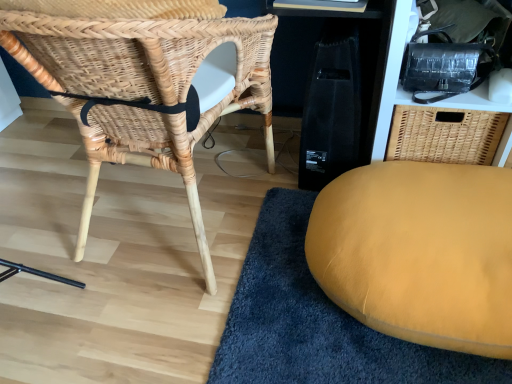
Where is `free space in front of natural woven chair at left`? free space in front of natural woven chair at left is located at coordinates (187, 330).